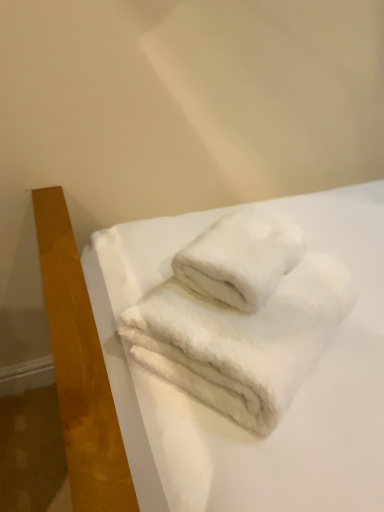
Where is `blank space situated above white fluffy sheet at center (from a real-world perspective)`? The width and height of the screenshot is (384, 512). blank space situated above white fluffy sheet at center (from a real-world perspective) is located at coordinates (247, 262).